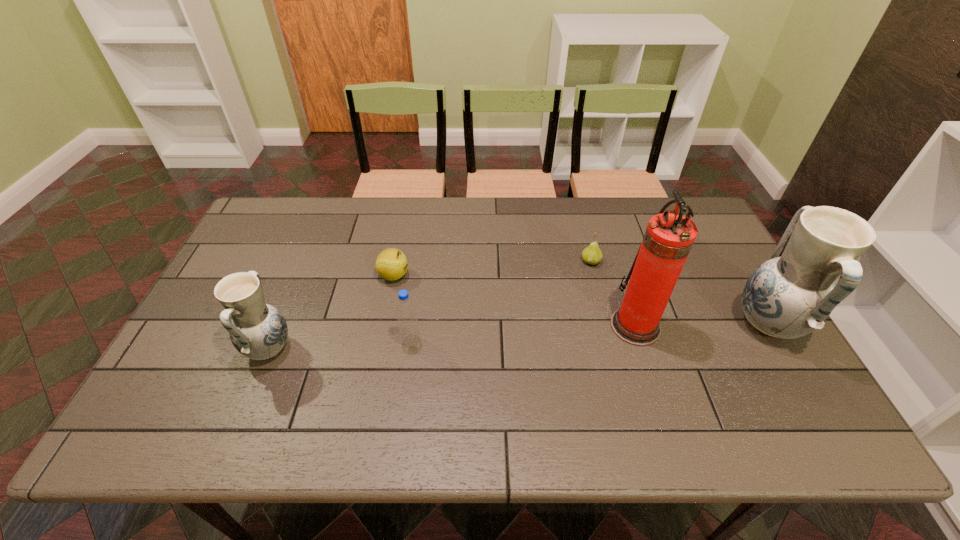
Identify the location of vacant region located 0.060m on either side of the fourth shortest object. Image resolution: width=960 pixels, height=540 pixels. (221, 348).

I want to click on blank area located on either side of the fourth shortest object, so tap(194, 348).

Find the location of a particular element. The height and width of the screenshot is (540, 960). vacant area located on the logo side of the softball is located at coordinates (534, 275).

Find the location of a particular element. The image size is (960, 540). free space located on the right of the pear is located at coordinates (682, 261).

You are a GUI agent. You are given a task and a screenshot of the screen. Output one action in this format:
    pyautogui.click(x=<x>, y=<y>)
    Task: Click on the vacant space located at the discharge end of the fire extinguisher
    The image size is (960, 540).
    Given the screenshot: What is the action you would take?
    pyautogui.click(x=591, y=326)

Where is `vacant space situated 0.280m at the discharge end of the fire extinguisher`? This screenshot has height=540, width=960. vacant space situated 0.280m at the discharge end of the fire extinguisher is located at coordinates (x=506, y=326).

I want to click on vacant area situated 0.190m at the discharge end of the fire extinguisher, so click(x=540, y=326).

Locate an element on the screen. free point located on the right of the third object from left to right is located at coordinates (498, 341).

This screenshot has width=960, height=540. What are the coordinates of `object at the near edge` in the screenshot? It's located at (257, 330).

This screenshot has width=960, height=540. Find the location of `object present at the left edge`. object present at the left edge is located at coordinates (257, 330).